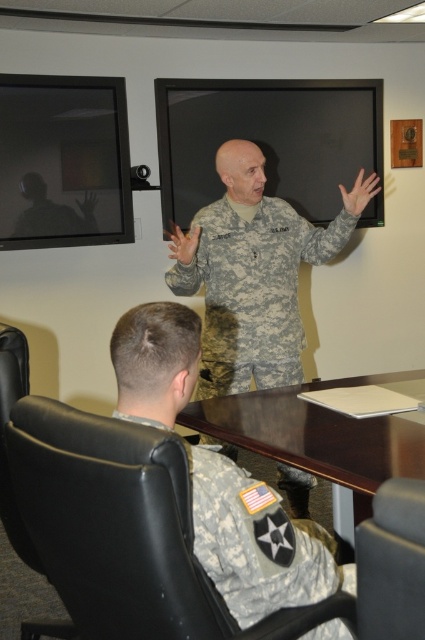
Is black leather chair at lower left closer to the viewer compared to matte black chair at lower right?

No.

Who is lower down, black leather chair at lower left or matte black chair at lower right?

black leather chair at lower left is lower down.

Locate an element on the screen. black leather chair at lower left is located at coordinates (112, 524).

In the scene shown: Which is more to the right, black leather chair at lower left or brown wood table at center?

brown wood table at center is more to the right.

Is point (95, 483) positioned in front of point (343, 433)?

Yes.

Find the location of `black leather chair at lower left`. black leather chair at lower left is located at coordinates (112, 524).

Is camouflage fabric uniform at center below brown wood table at center?

Actually, camouflage fabric uniform at center is above brown wood table at center.

Can you confirm if camouflage fabric uniform at center is shorter than brown wood table at center?

Incorrect, camouflage fabric uniform at center's height does not fall short of brown wood table at center's.

Does point (201, 269) lie in front of point (260, 413)?

No, (201, 269) is further to viewer.

Where is `camouflage fabric uniform at center`? camouflage fabric uniform at center is located at coordinates (252, 289).